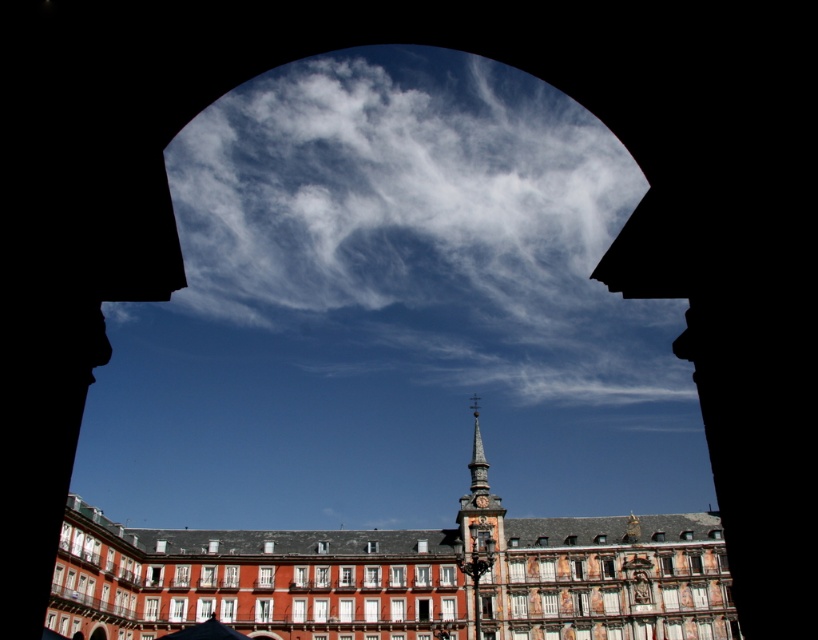
Is point (282, 547) closer to viewer compared to point (479, 490)?

That is True.

Looking at this image, does smooth red brick building at center have a smaller size compared to polished stone clock tower at center?

No.

Locate an element on the screen. This screenshot has width=818, height=640. smooth red brick building at center is located at coordinates point(399,579).

Which of these two, smooth red brick building at center or smooth gray spire at center, stands taller?

smooth red brick building at center is taller.

You are a GUI agent. You are given a task and a screenshot of the screen. Output one action in this format:
    pyautogui.click(x=<x>, y=<y>)
    Task: Click on the smooth red brick building at center
    This screenshot has height=640, width=818.
    Given the screenshot: What is the action you would take?
    pyautogui.click(x=399, y=579)

Find the location of a particular element. The image size is (818, 640). smooth red brick building at center is located at coordinates (399, 579).

Is point (649, 394) positioned behind point (475, 458)?

Yes.

Is point (374, 65) less distant than point (477, 403)?

No, (374, 65) is further to viewer.

Find the location of a particular element. white fluffy cloud at upper center is located at coordinates (416, 230).